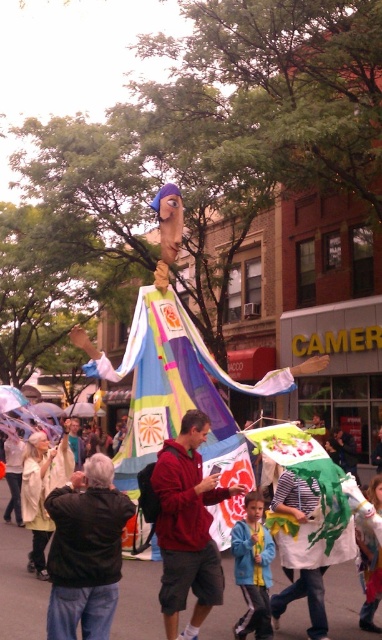
Is matte black jacket at center behind black leather jacket at lower left?

Yes, it is behind black leather jacket at lower left.

Does point (6, 548) come in front of point (92, 541)?

No, it is behind (92, 541).

Locate an element on the screen. The width and height of the screenshot is (382, 640). matte black jacket at center is located at coordinates (19, 584).

Does black leather jacket at lower left have a lesser width compared to matte red hoodie at center?

Correct, black leather jacket at lower left's width is less than matte red hoodie at center's.

Can you confirm if black leather jacket at lower left is shorter than matte red hoodie at center?

Indeed, black leather jacket at lower left has a lesser height compared to matte red hoodie at center.

Is point (119, 513) closer to viewer compared to point (215, 486)?

Yes.

This screenshot has width=382, height=640. Find the location of `black leather jacket at lower left`. black leather jacket at lower left is located at coordinates (85, 552).

Between matte black jacket at center and blue denim jacket at center, which one has more height?

Standing taller between the two is matte black jacket at center.

Is matte black jacket at center bigger than blue denim jacket at center?

Correct, matte black jacket at center is larger in size than blue denim jacket at center.

In order to click on matte black jacket at center in this screenshot , I will do `click(19, 584)`.